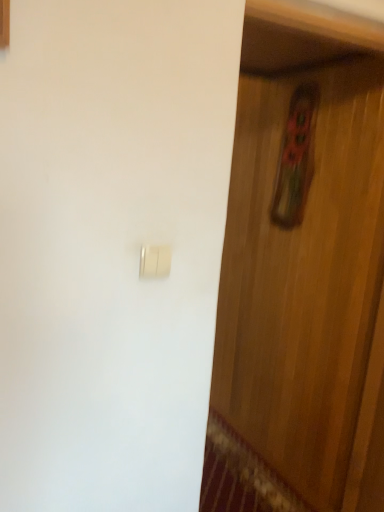
Question: Considering the relative positions of gold metallic light switch at center and wooden door at center in the image provided, is gold metallic light switch at center to the left or to the right of wooden door at center?

Choices:
 (A) left
 (B) right

Answer: (A)

Question: From a real-world perspective, is gold metallic light switch at center physically located above or below wooden door at center?

Choices:
 (A) below
 (B) above

Answer: (B)

Question: Is gold metallic light switch at center wider or thinner than wooden door at center?

Choices:
 (A) wide
 (B) thin

Answer: (B)

Question: Choose the correct answer: Is wooden door at center inside gold metallic light switch at center or outside it?

Choices:
 (A) outside
 (B) inside

Answer: (A)

Question: Is point (261, 109) closer or farther from the camera than point (158, 254)?

Choices:
 (A) closer
 (B) farther

Answer: (B)

Question: From the image's perspective, is wooden door at center above or below gold metallic light switch at center?

Choices:
 (A) above
 (B) below

Answer: (B)

Question: Is wooden door at center taller or shorter than gold metallic light switch at center?

Choices:
 (A) tall
 (B) short

Answer: (A)